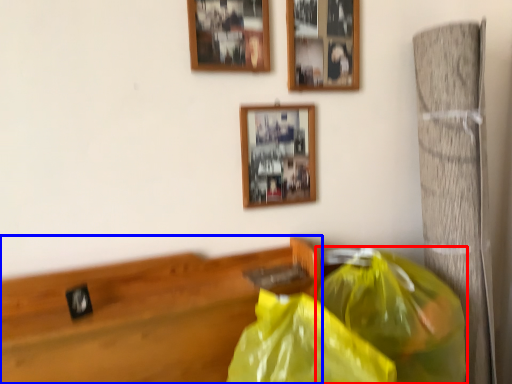
Question: Which object is closer to the camera taking this photo, plastic bag (highlighted by a red box) or furniture (highlighted by a blue box)?

Choices:
 (A) plastic bag
 (B) furniture

Answer: (A)